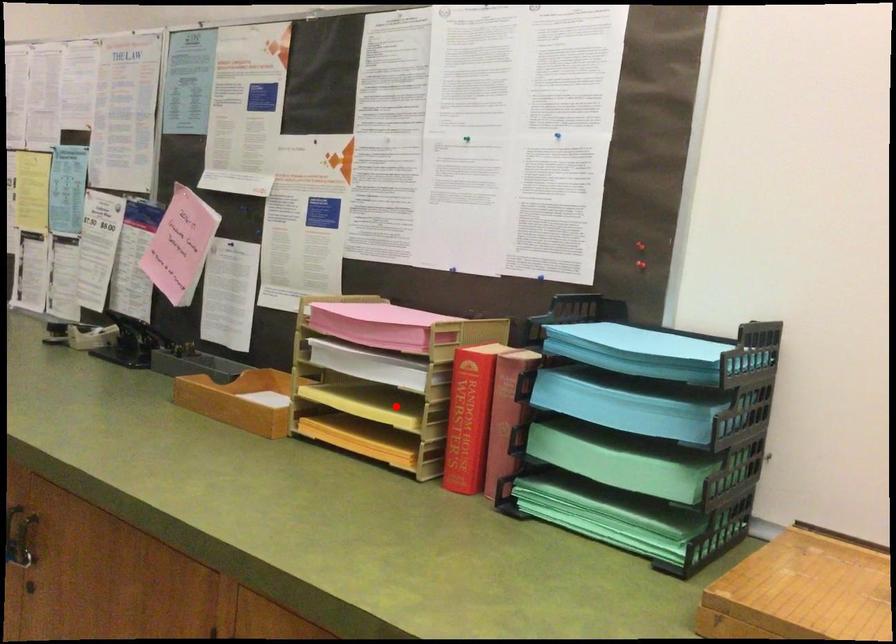
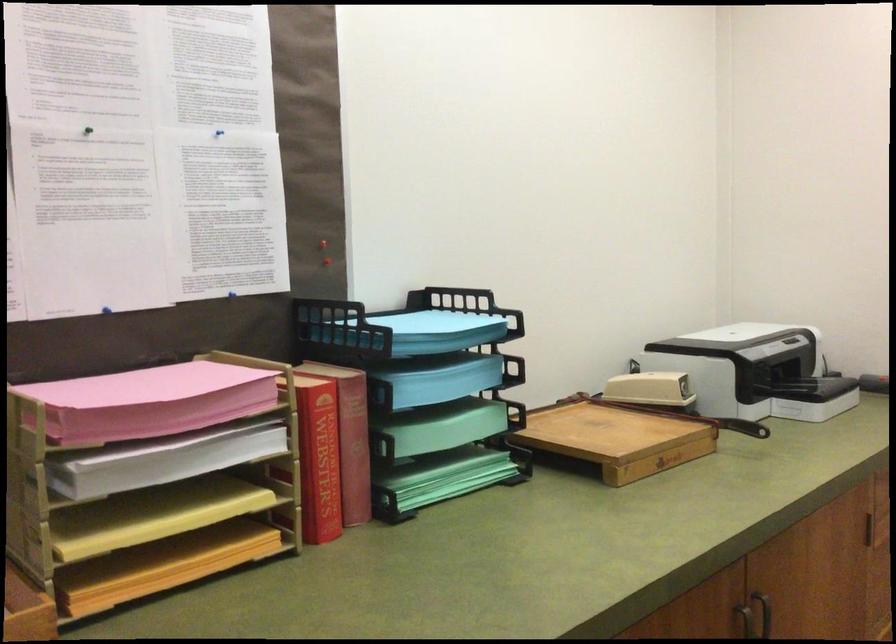
Question: I am providing you with two images of the same scene from different viewpoints. Given a red point in image1, look at the same physical point in image2. Is it:

Choices:
 (A) Closer to the viewpoint
 (B) Farther from the viewpoint

Answer: (A)